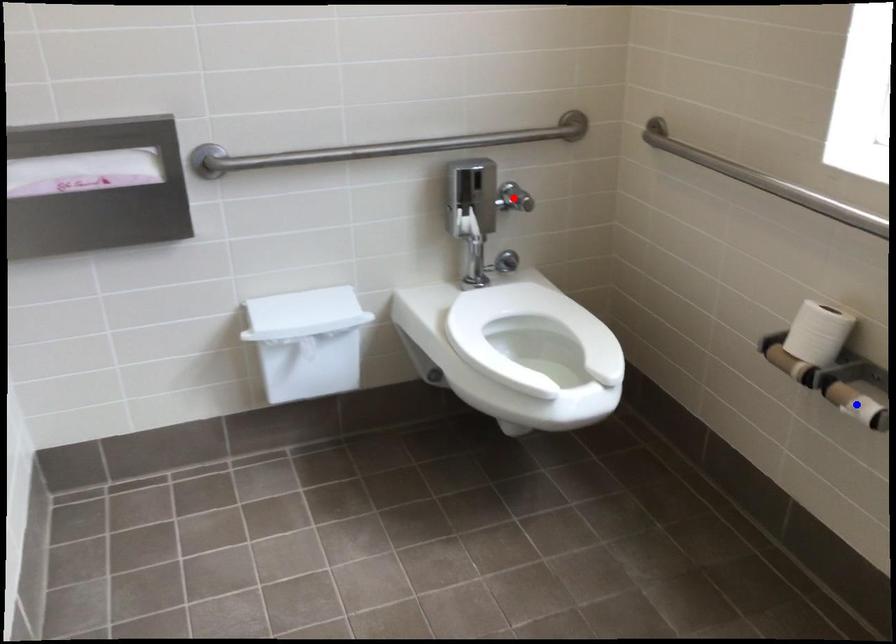
Question: Which of the two points in the image is closer to the camera?

Choices:
 (A) Blue point is closer.
 (B) Red point is closer.

Answer: (A)